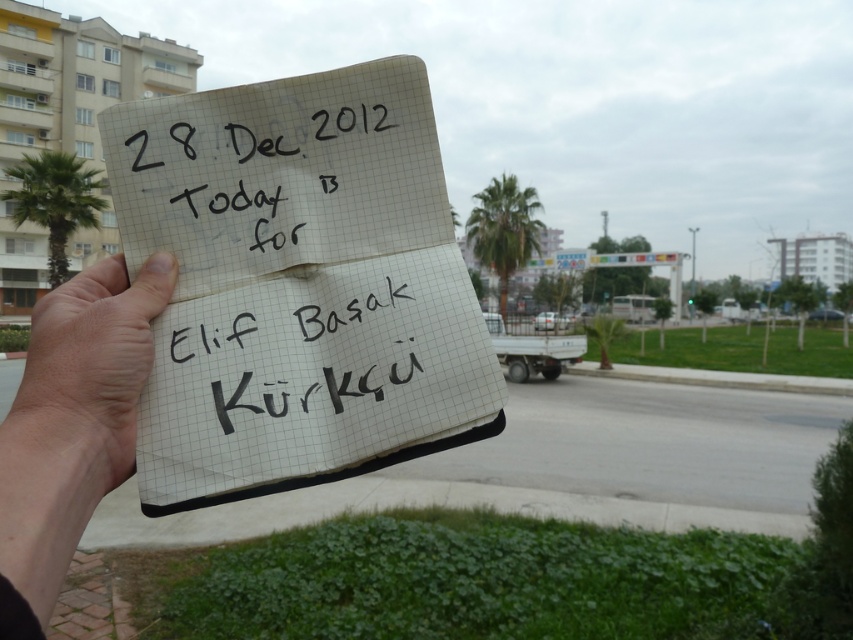
You are a photographer trying to capture the notebook in the scene. If you want to focus on the white paper at center, where should you aim your camera lens? Please provide coordinates based on the image grid system where the bottom left corner is the origin point.

The white paper at center is located at coordinates point (299, 284), so aim your camera lens at that point to focus on the white paper at center.

You are a photographer trying to capture the notebook in the scene. The notebook is held against the palm trees in the background. Which object, the white paper at center or the green leafy palm tree at upper center, is positioned lower in the image?

The white paper at center is positioned lower in the image than the green leafy palm tree at upper center.

You are an artist trying to sketch this scene. You notice the white paper at center and the green leafy palm tree at upper center. Which object would you need to draw with more detail in terms of thickness?

The green leafy palm tree at upper center is thicker than the white paper at center, so you should draw the green leafy palm tree at upper center with more detail in terms of thickness.